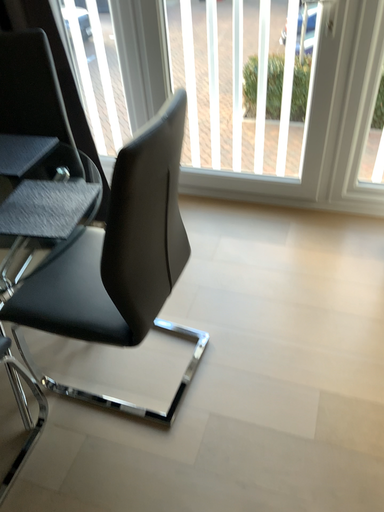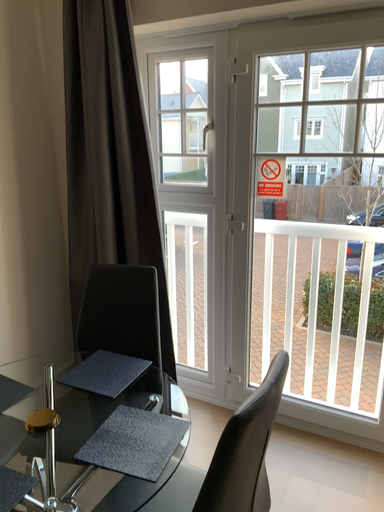
Question: How did the camera likely rotate when shooting the video?

Choices:
 (A) rotated downward
 (B) rotated upward

Answer: (B)